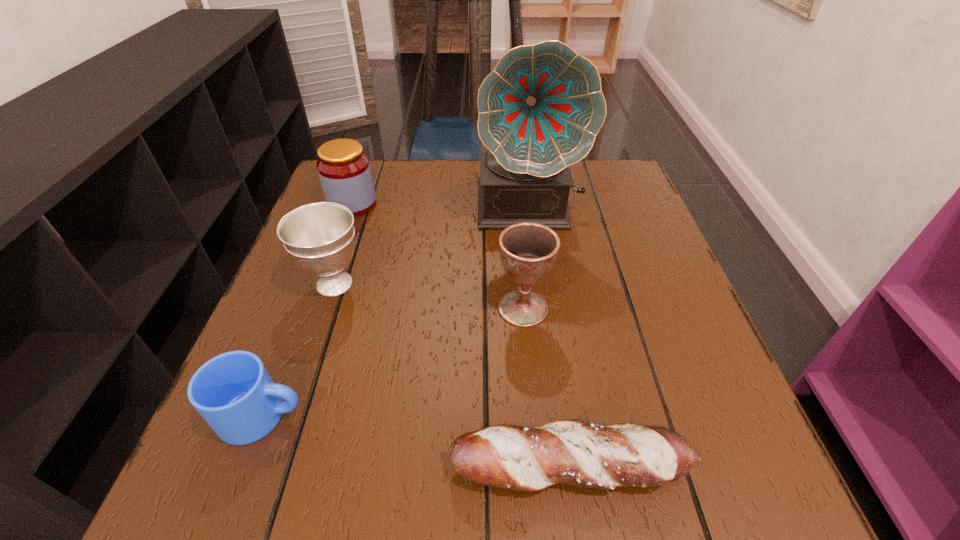
This screenshot has width=960, height=540. Find the location of `vacant point located between the right chalice and the shortest object`. vacant point located between the right chalice and the shortest object is located at coordinates (546, 387).

Where is `vacant space that's between the baguet and the right chalice`? This screenshot has width=960, height=540. vacant space that's between the baguet and the right chalice is located at coordinates pos(546,387).

At what (x,y) coordinates should I click in order to perform the action: click on free space between the jar and the record player. Please return your answer as a coordinate pair (x, y). The image size is (960, 540). Looking at the image, I should click on pos(441,205).

Locate an element on the screen. The image size is (960, 540). blank region between the left chalice and the baguet is located at coordinates (452, 375).

Where is `vacant area between the second shortest object and the right chalice`? Image resolution: width=960 pixels, height=540 pixels. vacant area between the second shortest object and the right chalice is located at coordinates (393, 362).

At what (x,y) coordinates should I click in order to perform the action: click on blank region between the jar and the right chalice. Please return your answer as a coordinate pair (x, y). This screenshot has height=540, width=960. Looking at the image, I should click on (438, 256).

The image size is (960, 540). In order to click on free point between the fifth tallest object and the right chalice in this screenshot , I will do `click(393, 362)`.

Where is `object that is the fifth closest one to the jar`? The height and width of the screenshot is (540, 960). object that is the fifth closest one to the jar is located at coordinates (573, 452).

Identify which object is the third nearest to the jar. Please provide its 2D coordinates. Your answer should be formatted as a tuple, i.e. [(x, y)], where the tuple contains the x and y coordinates of a point satisfying the conditions above.

[(528, 251)]

The image size is (960, 540). I want to click on vacant point that satisfies the following two spatial constraints: 1. on the side of the second shortest object with the handle; 2. on the left side of the baguet, so click(244, 465).